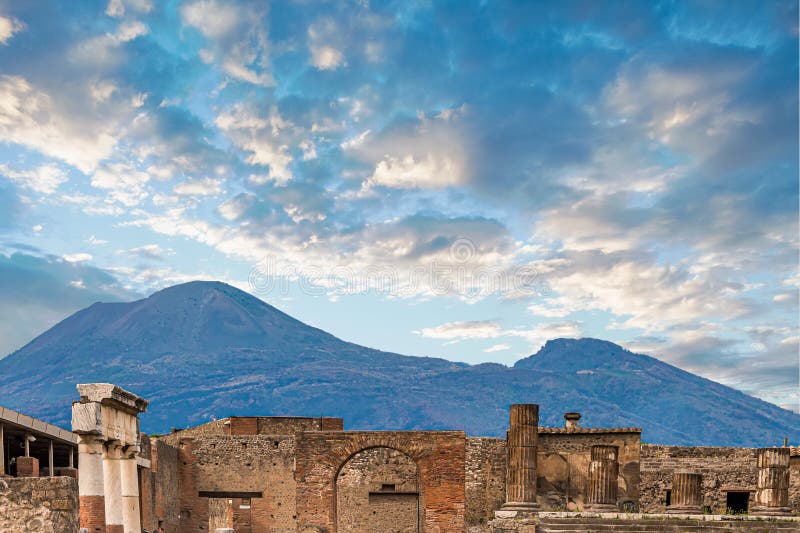
Where is `wall`? This screenshot has width=800, height=533. wall is located at coordinates (714, 491).